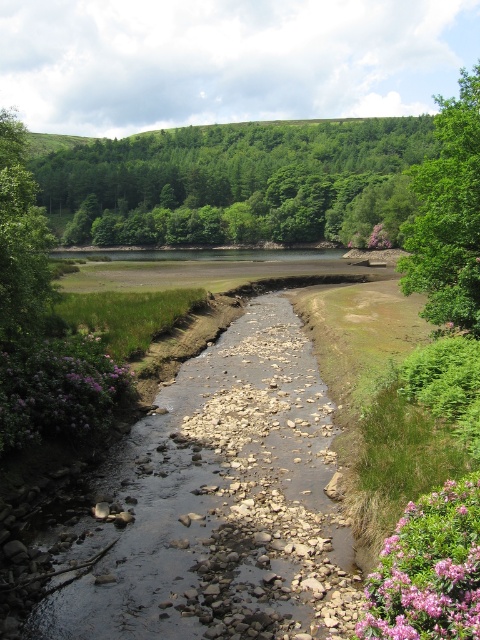
Does pink matte flowers at lower right appear on the left side of purple fuzzy bush at lower left?

No, pink matte flowers at lower right is not to the left of purple fuzzy bush at lower left.

Is pink matte flowers at lower right bigger than purple fuzzy bush at lower left?

Indeed, pink matte flowers at lower right has a larger size compared to purple fuzzy bush at lower left.

This screenshot has height=640, width=480. What do you see at coordinates (429, 570) in the screenshot?
I see `pink matte flowers at lower right` at bounding box center [429, 570].

At what (x,y) coordinates should I click in order to perform the action: click on pink matte flowers at lower right. Please return your answer as a coordinate pair (x, y). Image resolution: width=480 pixels, height=640 pixels. Looking at the image, I should click on (429, 570).

Can you confirm if purple fuzzy bush at lower left is positioned below purple matte flower at center-right?

Yes.

Can you confirm if purple fuzzy bush at lower left is positioned to the left of purple matte flower at center-right?

Indeed, purple fuzzy bush at lower left is positioned on the left side of purple matte flower at center-right.

At what (x,y) coordinates should I click in order to perform the action: click on purple fuzzy bush at lower left. Please return your answer as a coordinate pair (x, y). The width and height of the screenshot is (480, 640). Looking at the image, I should click on (56, 388).

Is green leafy trees at upper center positioned behind green leafy tree at right?

Yes, green leafy trees at upper center is behind green leafy tree at right.

Is green leafy trees at upper center above green leafy tree at right?

Yes.

The height and width of the screenshot is (640, 480). Identify the location of green leafy trees at upper center. (239, 182).